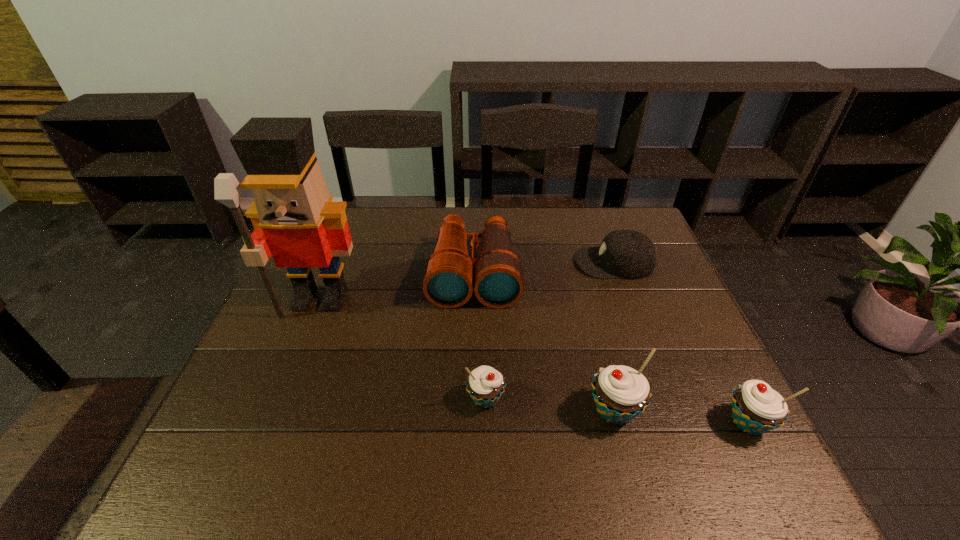
The width and height of the screenshot is (960, 540). Identify the location of cupcake that can be found as the third closest to the leftmost object. pyautogui.click(x=756, y=408).

The height and width of the screenshot is (540, 960). I want to click on vacant space that satisfies the following two spatial constraints: 1. in front of the tallest object holding the staff; 2. on the right side of the second cupcake from right to left, so click(x=277, y=410).

Locate an element on the screen. free point that satisfies the following two spatial constraints: 1. on the front-facing side of the second tallest cupcake; 2. on the left side of the cap is located at coordinates (672, 422).

Image resolution: width=960 pixels, height=540 pixels. In order to click on vacant space that satisfies the following two spatial constraints: 1. through the lenses of the binoculars; 2. on the right side of the shortest cupcake in this screenshot , I will do `click(472, 399)`.

Find the location of `free space that satisfies the following two spatial constraints: 1. in front of the nutcracker holding the staff; 2. on the right side of the second cupcake from right to left`. free space that satisfies the following two spatial constraints: 1. in front of the nutcracker holding the staff; 2. on the right side of the second cupcake from right to left is located at coordinates (277, 410).

Locate an element on the screen. The width and height of the screenshot is (960, 540). free space that satisfies the following two spatial constraints: 1. on the front-facing side of the cap; 2. in front of the nutcracker holding the staff is located at coordinates (628, 300).

Where is `free space that satisfies the following two spatial constraints: 1. through the lenses of the second cupcake from right to left; 2. on the right side of the binoculars`? This screenshot has height=540, width=960. free space that satisfies the following two spatial constraints: 1. through the lenses of the second cupcake from right to left; 2. on the right side of the binoculars is located at coordinates (472, 410).